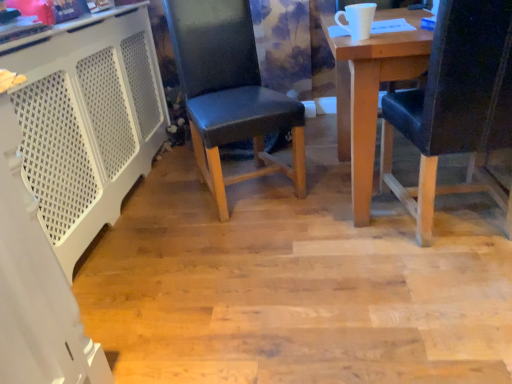
Where is `vacant area that lies in front of black leather chair at center, placed as the 1th chair when sorted from left to right`? This screenshot has height=384, width=512. vacant area that lies in front of black leather chair at center, placed as the 1th chair when sorted from left to right is located at coordinates (246, 240).